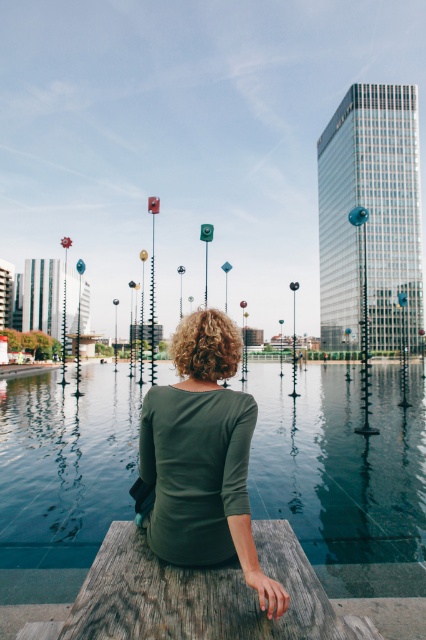
Is the position of transparent glass water at center more distant than that of green matte shirt at center?

Yes, transparent glass water at center is behind green matte shirt at center.

Who is positioned more to the left, transparent glass water at center or green matte shirt at center?

Positioned to the left is green matte shirt at center.

What do you see at coordinates (344, 476) in the screenshot?
I see `transparent glass water at center` at bounding box center [344, 476].

Locate an element on the screen. This screenshot has width=426, height=640. transparent glass water at center is located at coordinates pos(344,476).